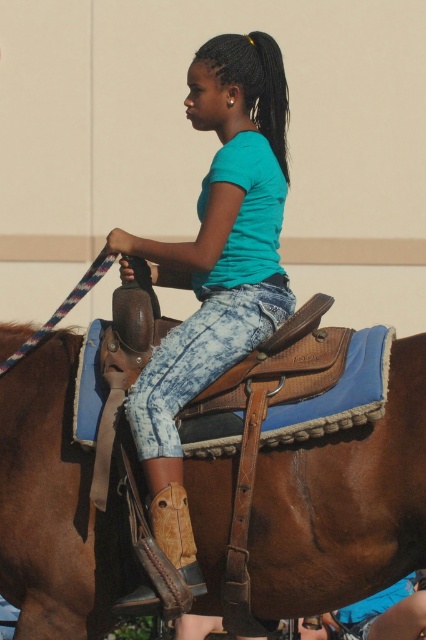
Question: Is brown leather saddle at center below teal matte shirt at center?

Choices:
 (A) no
 (B) yes

Answer: (B)

Question: Can you confirm if brown leather saddle at center is wider than teal matte shirt at center?

Choices:
 (A) no
 (B) yes

Answer: (B)

Question: Is brown leather saddle at center wider than teal matte shirt at center?

Choices:
 (A) no
 (B) yes

Answer: (B)